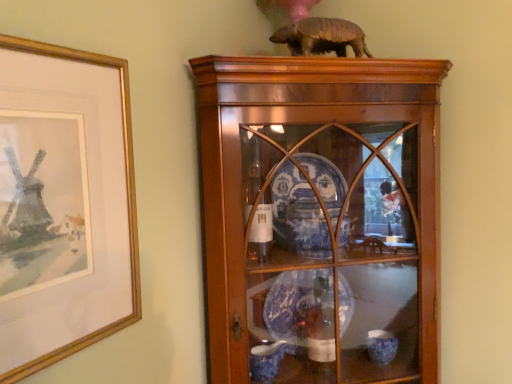
Question: Relative to gold-framed picture at left, is wooden cabinet at center in front or behind?

Choices:
 (A) front
 (B) behind

Answer: (B)

Question: Is wooden cabinet at center bigger or smaller than gold-framed picture at left?

Choices:
 (A) big
 (B) small

Answer: (A)

Question: Considering the real-world distances, which object is closest to the gold-framed picture at left?

Choices:
 (A) wooden cabinet at center
 (B) brown matte armadillo at upper center

Answer: (A)

Question: Which object is the closest to the wooden cabinet at center?

Choices:
 (A) gold-framed picture at left
 (B) brown matte armadillo at upper center

Answer: (B)